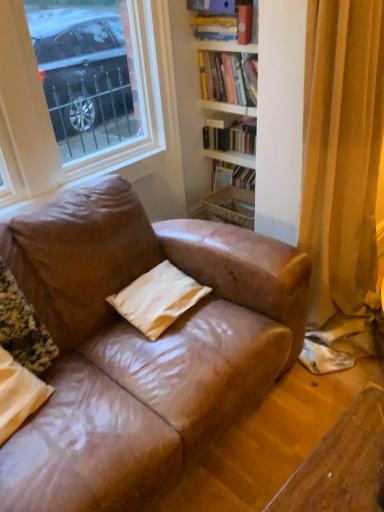
Question: Looking at their shapes, would you say matte hardcover book at upper right, which appears as the 1th book when viewed from the top, is wider or thinner than matte beige pillow at lower left, the first pillow when ordered from left to right?

Choices:
 (A) thin
 (B) wide

Answer: (A)

Question: From a real-world perspective, is matte hardcover book at upper right, which appears as the 1th book when viewed from the top, physically located above or below matte beige pillow at lower left, the second pillow from the right?

Choices:
 (A) below
 (B) above

Answer: (B)

Question: Estimate the real-world distances between objects in this image. Which object is closer to the matte hardcover book at upper right, which appears as the 1th book when viewed from the top?

Choices:
 (A) white matte bookshelf at upper center, acting as the 3th book starting from the top
 (B) white matte pillow at center, the first pillow from the right
 (C) hardcover books at upper center, positioned as the 2th book in bottom-to-top order
 (D) matte beige pillow at lower left, the second pillow from the right

Answer: (C)

Question: Estimate the real-world distances between objects in this image. Which object is closer to the matte hardcover book at upper right, which appears as the 1th book when viewed from the top?

Choices:
 (A) matte beige pillow at lower left, the second pillow from the right
 (B) white matte pillow at center, the first pillow from the right
 (C) hardcover books at upper center, positioned as the 2th book in bottom-to-top order
 (D) white matte bookshelf at upper center, which is counted as the first book, starting from the bottom

Answer: (C)